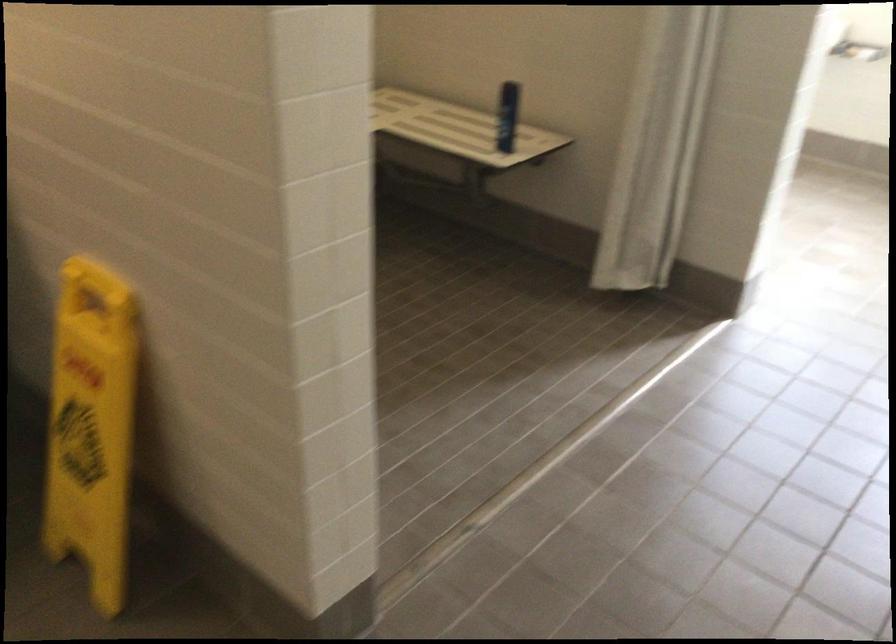
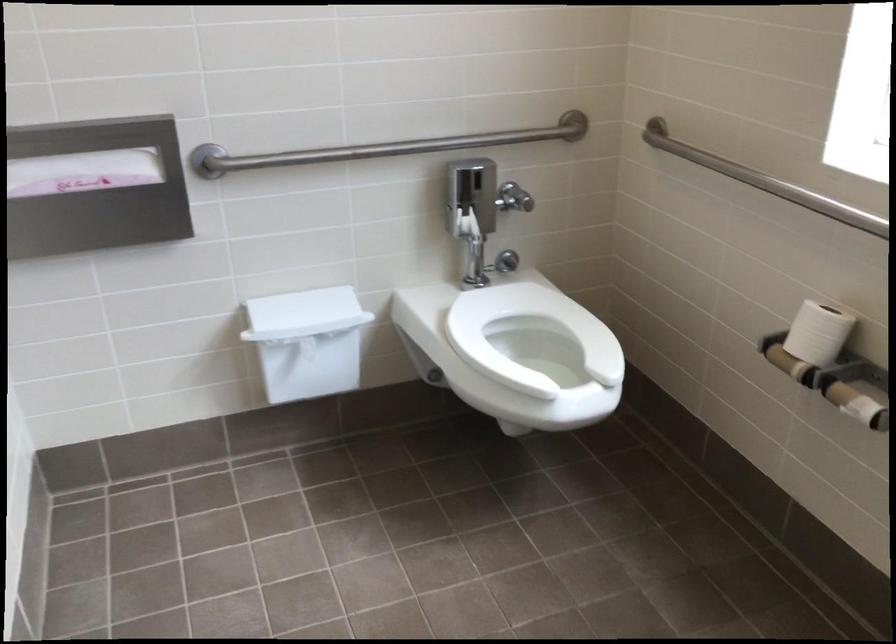
In the scene shown: The images are taken continuously from a first-person perspective. In which direction are you moving?

The cameraman walked toward right, forward.